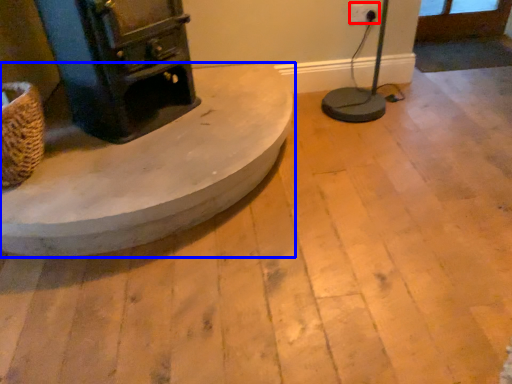
Question: Which object appears farthest to the camera in this image, electric outlet (highlighted by a red box) or furniture (highlighted by a blue box)?

Choices:
 (A) electric outlet
 (B) furniture

Answer: (A)